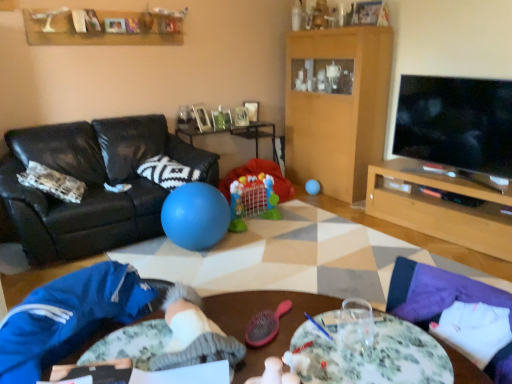
Locate an element on the screen. vacant area in front of matte blue ball at center, which appears as the second ball when viewed from the front is located at coordinates (324, 200).